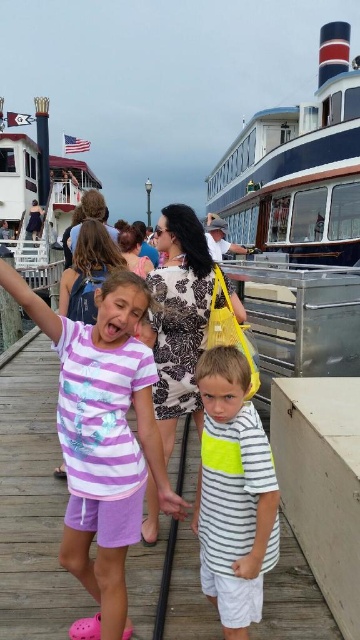
Consider the image. You are standing at the dock and want to take a photo of the blue polished wood boat at upper center and the striped cotton shirt at center. Which object should you focus on first to ensure both are in the frame?

You should focus on the blue polished wood boat at upper center first because it is closer to you than the striped cotton shirt at center, ensuring both are in the frame.

You are a photographer standing at the dock area. You want to capture a photo of both the blue polished wood boat at upper center and the white wooden boat at upper left without any obstructions. Which boat should you position closer to the camera to ensure both are fully visible in the frame?

The blue polished wood boat at upper center is thinner than the white wooden boat at upper left, so positioning the blue polished wood boat at upper center closer to the camera would allow both boats to fit in the frame while accommodating their widths.